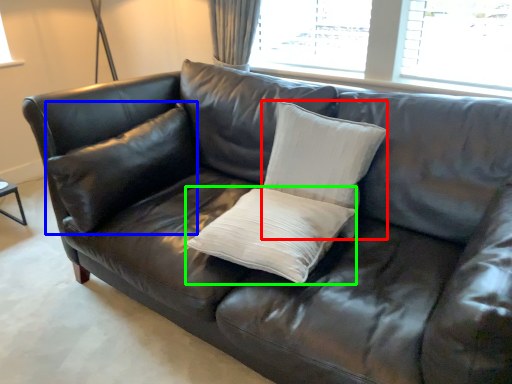
Question: Which object is positioned farthest from pillow (highlighted by a red box)? Select from pillow (highlighted by a blue box) and pillow (highlighted by a green box).

Choices:
 (A) pillow
 (B) pillow

Answer: (A)